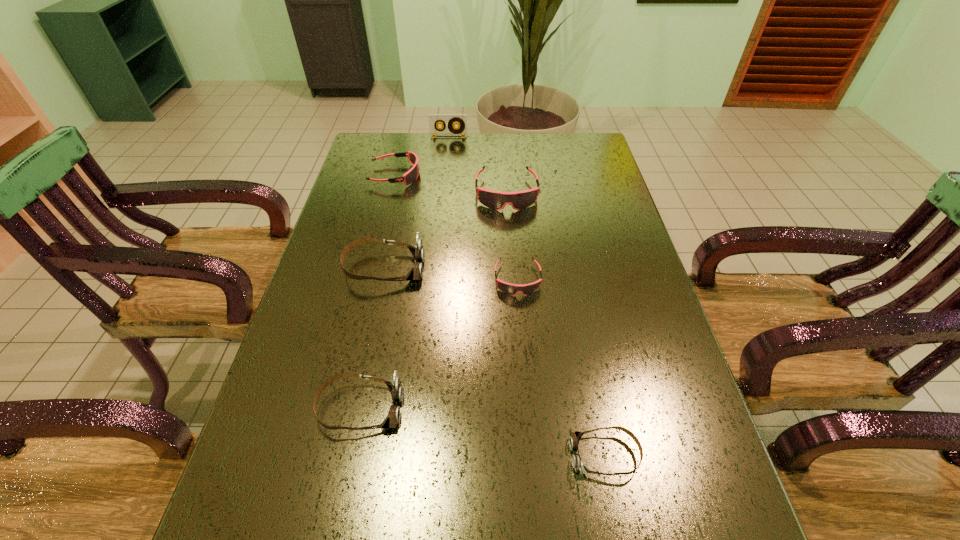
I want to click on free region located 0.390m on the front-facing side of the farthest brown goggles, so click(x=571, y=268).

The width and height of the screenshot is (960, 540). I want to click on vacant area situated on the front-facing side of the second smallest pink goggles, so click(501, 175).

Identify the location of vacant region located on the front-facing side of the second biggest brown goggles. (500, 408).

The image size is (960, 540). In order to click on vacant space situated on the front-facing side of the nearest pink goggles in this screenshot , I will do `click(520, 316)`.

Identify the location of vacant space situated on the front-facing side of the smallest brown goggles. (395, 455).

This screenshot has height=540, width=960. In order to click on vacant space situated on the front-facing side of the smallest brown goggles in this screenshot , I will do point(517,455).

Find the location of a particular element. vacant space situated 0.320m on the front-facing side of the smallest brown goggles is located at coordinates (399, 455).

Find the location of `videotape that is at the far edge`. videotape that is at the far edge is located at coordinates (434, 119).

Where is `goggles that is positioned at the far edge`? The image size is (960, 540). goggles that is positioned at the far edge is located at coordinates (411, 176).

This screenshot has width=960, height=540. Identify the location of object positioned at the right edge. (575, 437).